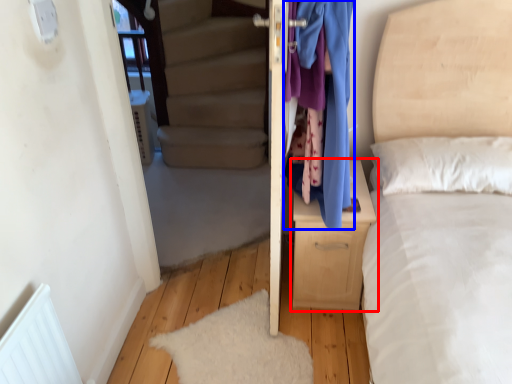
Question: Which point is closer to the camera, nightstand (highlighted by a red box) or clothing (highlighted by a blue box)?

Choices:
 (A) nightstand
 (B) clothing

Answer: (B)